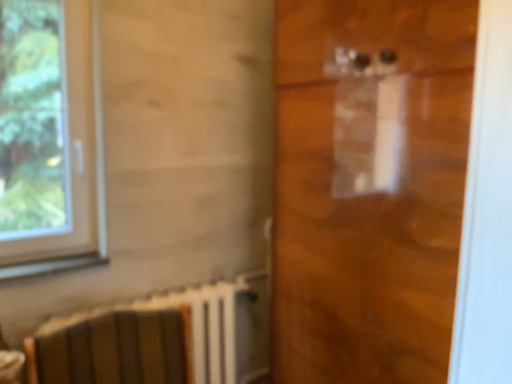
Describe the element at coordinates (11, 366) in the screenshot. The image size is (512, 384). I see `matte brown table at lower left` at that location.

Locate an element on the screen. The width and height of the screenshot is (512, 384). wooden armchair at lower left is located at coordinates (115, 350).

The height and width of the screenshot is (384, 512). What are the coordinates of `transparent plastic door at center` in the screenshot? It's located at (369, 189).

Which object is further away from the camera, wooden armchair at lower left or white plastic window at left?

white plastic window at left is more distant.

Is wooden armchair at lower left outside of white plastic window at left?

Yes, wooden armchair at lower left is not within white plastic window at left.

Is point (140, 376) farther from camera compared to point (37, 71)?

No, (140, 376) is closer to viewer.

In the scene shown: Is wooden armchair at lower left to the right of white plastic window at left from the viewer's perspective?

Yes, wooden armchair at lower left is to the right of white plastic window at left.

From a real-world perspective, is white plastic window at left on top of wooden armchair at lower left?

Correct, in the physical world, white plastic window at left is higher than wooden armchair at lower left.

Is white plastic window at left to the left or to the right of wooden armchair at lower left in the image?

Based on their positions, white plastic window at left is located to the left of wooden armchair at lower left.

Considering the positions of objects white plastic window at left and wooden armchair at lower left in the image provided, who is in front, white plastic window at left or wooden armchair at lower left?

wooden armchair at lower left is more forward.

From the image's perspective, which is above, white plastic window at left or wooden armchair at lower left?

white plastic window at left appears higher in the image.

Are transparent plastic door at center and matte brown table at lower left far apart?

That's right, there is a large distance between transparent plastic door at center and matte brown table at lower left.

From a real-world perspective, is transparent plastic door at center on matte brown table at lower left?

Correct, in the physical world, transparent plastic door at center is higher than matte brown table at lower left.

Which of these two, transparent plastic door at center or matte brown table at lower left, stands shorter?

Standing shorter between the two is matte brown table at lower left.

From the picture: Is transparent plastic door at center positioned beyond the bounds of matte brown table at lower left?

That's correct, transparent plastic door at center is outside of matte brown table at lower left.

From a real-world perspective, relative to matte brown table at lower left, is white plastic window at left vertically above or below?

From a real-world perspective, white plastic window at left is physically above matte brown table at lower left.

Measure the distance from white plastic window at left to matte brown table at lower left.

2.49 meters.

From the image's perspective, is white plastic window at left on matte brown table at lower left?

Indeed, from the image's perspective, white plastic window at left is shown above matte brown table at lower left.

Is point (78, 136) more distant than point (15, 381)?

Yes.

From a real-world perspective, which is physically above, wooden armchair at lower left or matte brown table at lower left?

matte brown table at lower left.

Is the position of wooden armchair at lower left less distant than that of matte brown table at lower left?

Yes, the depth of wooden armchair at lower left is less than that of matte brown table at lower left.

In the scene shown: Considering the sizes of wooden armchair at lower left and matte brown table at lower left in the image, is wooden armchair at lower left bigger or smaller than matte brown table at lower left?

Considering their sizes, wooden armchair at lower left takes up more space than matte brown table at lower left.

Where is `window positioned vertically above the matte brown table at lower left (from a real-world perspective)`? This screenshot has width=512, height=384. window positioned vertically above the matte brown table at lower left (from a real-world perspective) is located at coordinates click(50, 138).

Which is behind, point (18, 355) or point (68, 186)?

Positioned behind is point (68, 186).

From the picture: Between matte brown table at lower left and white plastic window at left, which one appears on the left side from the viewer's perspective?

matte brown table at lower left is more to the left.

Looking at this image, could you tell me if matte brown table at lower left is turned towards white plastic window at left?

No, matte brown table at lower left is not turned towards white plastic window at left.

From the image's perspective, between transparent plastic door at center and white plastic window at left, who is located below?

transparent plastic door at center is shown below in the image.

From a real-world perspective, who is located lower, transparent plastic door at center or white plastic window at left?

From a 3D spatial view, transparent plastic door at center is below.

Does transparent plastic door at center appear on the right side of white plastic window at left?

Indeed, transparent plastic door at center is positioned on the right side of white plastic window at left.

I want to click on window on the left side of wooden armchair at lower left, so click(50, 138).

Where is `armchair lying on the right of white plastic window at left`? The image size is (512, 384). armchair lying on the right of white plastic window at left is located at coordinates (115, 350).

Based on their spatial positions, is white plastic window at left or transparent plastic door at center closer to matte brown table at lower left?

transparent plastic door at center is closer to matte brown table at lower left.

When comparing their distances from wooden armchair at lower left, does white plastic window at left or matte brown table at lower left seem closer?

matte brown table at lower left is positioned closer to the anchor wooden armchair at lower left.

Considering their positions, is white plastic window at left positioned closer to transparent plastic door at center than matte brown table at lower left?

Among the two, matte brown table at lower left is located nearer to transparent plastic door at center.

Which object lies nearer to the anchor point matte brown table at lower left, transparent plastic door at center or white plastic window at left?

transparent plastic door at center lies closer to matte brown table at lower left than the other object.

From the image, which object appears to be farther from transparent plastic door at center, wooden armchair at lower left or matte brown table at lower left?

Among the two, matte brown table at lower left is located further to transparent plastic door at center.

From the image, which object appears to be nearer to matte brown table at lower left, transparent plastic door at center or wooden armchair at lower left?

wooden armchair at lower left is positioned closer to the anchor matte brown table at lower left.

Which object lies further to the anchor point wooden armchair at lower left, transparent plastic door at center or white plastic window at left?

white plastic window at left is positioned further to the anchor wooden armchair at lower left.

Considering their positions, is wooden armchair at lower left positioned further to matte brown table at lower left than transparent plastic door at center?

transparent plastic door at center is further to matte brown table at lower left.

You are a GUI agent. You are given a task and a screenshot of the screen. Output one action in this format:
    pyautogui.click(x=<x>, y=<y>)
    Task: Click on the armchair between white plastic window at left and transparent plastic door at center in the horizontal direction
    
    Given the screenshot: What is the action you would take?
    pyautogui.click(x=115, y=350)

Where is `window between matte brown table at lower left and transparent plastic door at center in the horizontal direction`? This screenshot has width=512, height=384. window between matte brown table at lower left and transparent plastic door at center in the horizontal direction is located at coordinates (50, 138).

In order to click on armchair situated between matte brown table at lower left and transparent plastic door at center from left to right in this screenshot , I will do `click(115, 350)`.

The image size is (512, 384). I want to click on table between white plastic window at left and wooden armchair at lower left in the vertical direction, so click(11, 366).